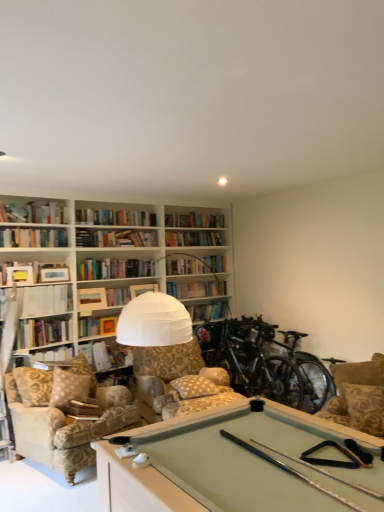
Question: Can you confirm if patterned fabric armchair at right is positioned to the right of velvet beige armchair at lower left?

Choices:
 (A) yes
 (B) no

Answer: (A)

Question: Is patterned fabric armchair at right positioned with its back to velvet beige armchair at lower left?

Choices:
 (A) yes
 (B) no

Answer: (B)

Question: From a real-world perspective, is patterned fabric armchair at right positioned under velvet beige armchair at lower left based on gravity?

Choices:
 (A) yes
 (B) no

Answer: (B)

Question: Is patterned fabric armchair at right not within velvet beige armchair at lower left?

Choices:
 (A) yes
 (B) no

Answer: (A)

Question: Is patterned fabric armchair at right behind velvet beige armchair at lower left?

Choices:
 (A) yes
 (B) no

Answer: (B)

Question: Can you confirm if patterned fabric armchair at right is wider than velvet beige armchair at lower left?

Choices:
 (A) yes
 (B) no

Answer: (B)

Question: Does green matte bicycle at right lie in front of velvet beige armchair at lower left?

Choices:
 (A) yes
 (B) no

Answer: (B)

Question: From a real-world perspective, is green matte bicycle at right on velvet beige armchair at lower left?

Choices:
 (A) no
 (B) yes

Answer: (B)

Question: Can you confirm if green matte bicycle at right is positioned to the left of velvet beige armchair at lower left?

Choices:
 (A) no
 (B) yes

Answer: (A)

Question: Would you say velvet beige armchair at lower left is part of green matte bicycle at right's contents?

Choices:
 (A) yes
 (B) no

Answer: (B)

Question: Can you confirm if green matte bicycle at right is smaller than velvet beige armchair at lower left?

Choices:
 (A) yes
 (B) no

Answer: (A)

Question: Is the position of green matte bicycle at right more distant than that of velvet beige armchair at lower left?

Choices:
 (A) no
 (B) yes

Answer: (B)

Question: Is hardcover book at center, the second book in the left-to-right sequence, not close to patterned fabric armchair at right?

Choices:
 (A) no
 (B) yes

Answer: (B)